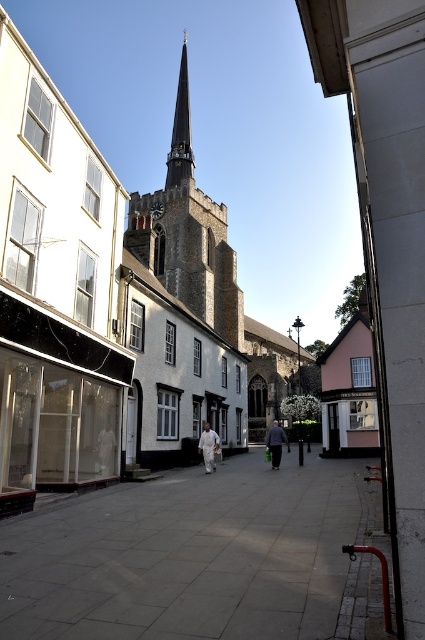
You are a photographer standing on the street looking at the white fabric person at center and the dark gray fabric coat at center. Which object is positioned higher in the image?

The white fabric person at center is positioned higher than the dark gray fabric coat at center in the image.

You are a delivery person trying to walk through the street in the image. You see the gray concrete pavement at center and the white fabric person at center. Which path is wider for you to walk through?

The gray concrete pavement at center is wider than the white fabric person at center, so you should choose the gray concrete pavement at center to walk through.